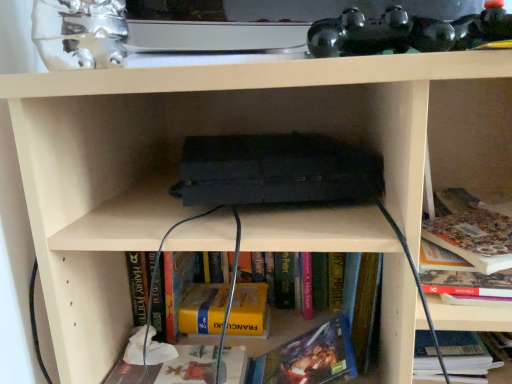
You are a GUI agent. You are given a task and a screenshot of the screen. Output one action in this format:
    pyautogui.click(x=<x>, y=<y>)
    Task: Click on the hardcover book at lower right, which is counted as the fourth book, starting from the left
    This screenshot has width=512, height=384.
    Given the screenshot: What is the action you would take?
    pyautogui.click(x=472, y=232)

The image size is (512, 384). What do you see at coordinates (203, 309) in the screenshot?
I see `yellow matte book at center, which is the 2th book in left-to-right order` at bounding box center [203, 309].

Find the location of `matte paper book at lower center, which ranks as the first book in left-to-right order`. matte paper book at lower center, which ranks as the first book in left-to-right order is located at coordinates (187, 366).

The width and height of the screenshot is (512, 384). I want to click on hardcover book at lower right, which is counted as the first book, starting from the right, so (472, 232).

Is hardcover book at lower right, which is counted as the fourth book, starting from the left, in contact with hardcover book at lower center, the 3th book positioned from the left?

There is a gap between hardcover book at lower right, which is counted as the fourth book, starting from the left, and hardcover book at lower center, the 3th book positioned from the left.

From a real-world perspective, between hardcover book at lower right, which is counted as the fourth book, starting from the left, and hardcover book at lower center, the 3th book positioned from the left, who is vertically lower?

From a 3D spatial view, hardcover book at lower center, the 3th book positioned from the left, is below.

Which of these two, hardcover book at lower right, which is counted as the fourth book, starting from the left, or hardcover book at lower center, the 3th book positioned from the left, is smaller?

With smaller size is hardcover book at lower center, the 3th book positioned from the left.

Does point (504, 263) lie in front of point (310, 336)?

Yes, point (504, 263) is in front of point (310, 336).

Which of these two, hardcover book at lower right, which is counted as the first book, starting from the right, or yellow matte book at center, which is the 2th book in left-to-right order, stands taller?

Standing taller between the two is hardcover book at lower right, which is counted as the first book, starting from the right.

From the picture: How many degrees apart are the facing directions of hardcover book at lower right, which is counted as the first book, starting from the right, and yellow matte book at center, the third book when ordered from right to left?

0.835 degrees separate the facing orientations of hardcover book at lower right, which is counted as the first book, starting from the right, and yellow matte book at center, the third book when ordered from right to left.

Is point (493, 228) closer to camera compared to point (236, 317)?

That is True.

From the image's perspective, between hardcover book at lower right, which is counted as the fourth book, starting from the left, and yellow matte book at center, which is the 2th book in left-to-right order, who is located below?

yellow matte book at center, which is the 2th book in left-to-right order.

Which book is the 3rd one when counting from the left side of the hardcover book at lower right, which is counted as the first book, starting from the right? Please provide its 2D coordinates.

[(187, 366)]

Is hardcover book at lower right, which is counted as the first book, starting from the right, surrounding matte paper book at lower center, which ranks as the first book in left-to-right order?

Actually, matte paper book at lower center, which ranks as the first book in left-to-right order, is outside hardcover book at lower right, which is counted as the first book, starting from the right.

Which object is positioned more to the left, hardcover book at lower right, which is counted as the fourth book, starting from the left, or matte paper book at lower center, which is counted as the 4th book, starting from the right?

From the viewer's perspective, matte paper book at lower center, which is counted as the 4th book, starting from the right, appears more on the left side.

Is hardcover book at lower right, which is counted as the fourth book, starting from the left, far away from matte paper book at lower center, which ranks as the first book in left-to-right order?

They are positioned close to each other.

Is matte paper book at lower center, which is counted as the 4th book, starting from the right, bigger than yellow matte book at center, which is the 2th book in left-to-right order?

Correct, matte paper book at lower center, which is counted as the 4th book, starting from the right, is larger in size than yellow matte book at center, which is the 2th book in left-to-right order.

Measure the distance from matte paper book at lower center, which ranks as the first book in left-to-right order, to yellow matte book at center, which is the 2th book in left-to-right order.

The distance of matte paper book at lower center, which ranks as the first book in left-to-right order, from yellow matte book at center, which is the 2th book in left-to-right order, is 3.97 inches.

In terms of height, does matte paper book at lower center, which is counted as the 4th book, starting from the right, look taller or shorter compared to yellow matte book at center, the third book when ordered from right to left?

Clearly, matte paper book at lower center, which is counted as the 4th book, starting from the right, is shorter compared to yellow matte book at center, the third book when ordered from right to left.

Does matte paper book at lower center, which is counted as the 4th book, starting from the right, come behind yellow matte book at center, the third book when ordered from right to left?

No.

Is matte paper book at lower center, which ranks as the first book in left-to-right order, to the left or to the right of hardcover book at lower right, which is counted as the fourth book, starting from the left, in the image?

Based on their positions, matte paper book at lower center, which ranks as the first book in left-to-right order, is located to the left of hardcover book at lower right, which is counted as the fourth book, starting from the left.

This screenshot has width=512, height=384. There is a hardcover book at lower right, which is counted as the first book, starting from the right. Identify the location of the 3rd book below it (from the image's perspective). (187, 366).

Consider the image. Does matte paper book at lower center, which ranks as the first book in left-to-right order, have a greater height compared to hardcover book at lower right, which is counted as the fourth book, starting from the left?

In fact, matte paper book at lower center, which ranks as the first book in left-to-right order, may be shorter than hardcover book at lower right, which is counted as the fourth book, starting from the left.

Considering the sizes of objects matte paper book at lower center, which is counted as the 4th book, starting from the right, and hardcover book at lower right, which is counted as the fourth book, starting from the left, in the image provided, who is bigger, matte paper book at lower center, which is counted as the 4th book, starting from the right, or hardcover book at lower right, which is counted as the fourth book, starting from the left,?

Bigger between the two is hardcover book at lower right, which is counted as the fourth book, starting from the left.

Is matte paper book at lower center, which is counted as the 4th book, starting from the right, positioned beyond the bounds of hardcover book at lower center, the 3th book positioned from the left?

Yes.

Which object is positioned more to the left, matte paper book at lower center, which ranks as the first book in left-to-right order, or hardcover book at lower center, the 3th book positioned from the left?

matte paper book at lower center, which ranks as the first book in left-to-right order, is more to the left.

From a real-world perspective, relative to hardcover book at lower center, the 3th book positioned from the left, is matte paper book at lower center, which ranks as the first book in left-to-right order, vertically above or below?

In terms of real-world spatial position, matte paper book at lower center, which ranks as the first book in left-to-right order, is below hardcover book at lower center, the 3th book positioned from the left.

Is point (219, 314) closer or farther from the camera than point (248, 376)?

Point (219, 314) is farther from the camera than point (248, 376).

Based on the photo, do you think yellow matte book at center, the third book when ordered from right to left, is within hardcover book at lower center, positioned as the 2th book in right-to-left order, or outside of it?

yellow matte book at center, the third book when ordered from right to left, is not inside hardcover book at lower center, positioned as the 2th book in right-to-left order, it's outside.

Who is taller, yellow matte book at center, the third book when ordered from right to left, or hardcover book at lower center, the 3th book positioned from the left?

hardcover book at lower center, the 3th book positioned from the left, is taller.

From the image's perspective, which book is the 2nd one below the hardcover book at lower right, which is counted as the fourth book, starting from the left? Please provide its 2D coordinates.

[(308, 357)]

Find the location of `book that appears above the yellow matte book at center, which is the 2th book in left-to-right order (from the image's perspective)`. book that appears above the yellow matte book at center, which is the 2th book in left-to-right order (from the image's perspective) is located at coordinates (472, 232).

Which object lies further to the anchor point yellow matte book at center, which is the 2th book in left-to-right order, hardcover book at lower center, positioned as the 2th book in right-to-left order, or hardcover book at lower right, which is counted as the fourth book, starting from the left?

hardcover book at lower right, which is counted as the fourth book, starting from the left.

From the picture: Which object lies nearer to the anchor point hardcover book at lower right, which is counted as the fourth book, starting from the left, matte paper book at lower center, which is counted as the 4th book, starting from the right, or yellow matte book at center, which is the 2th book in left-to-right order?

yellow matte book at center, which is the 2th book in left-to-right order, is closer to hardcover book at lower right, which is counted as the fourth book, starting from the left.

Considering their positions, is matte paper book at lower center, which is counted as the 4th book, starting from the right, positioned closer to hardcover book at lower right, which is counted as the first book, starting from the right, than hardcover book at lower center, positioned as the 2th book in right-to-left order?

hardcover book at lower center, positioned as the 2th book in right-to-left order, is closer to hardcover book at lower right, which is counted as the first book, starting from the right.

When comparing their distances from matte paper book at lower center, which ranks as the first book in left-to-right order, does yellow matte book at center, which is the 2th book in left-to-right order, or hardcover book at lower center, the 3th book positioned from the left, seem closer?

yellow matte book at center, which is the 2th book in left-to-right order, is positioned closer to the anchor matte paper book at lower center, which ranks as the first book in left-to-right order.

When comparing their distances from yellow matte book at center, the third book when ordered from right to left, does hardcover book at lower right, which is counted as the fourth book, starting from the left, or hardcover book at lower center, the 3th book positioned from the left, seem closer?

hardcover book at lower center, the 3th book positioned from the left.

Which object lies nearer to the anchor point matte paper book at lower center, which is counted as the 4th book, starting from the right, hardcover book at lower center, positioned as the 2th book in right-to-left order, or hardcover book at lower right, which is counted as the fourth book, starting from the left?

The object closer to matte paper book at lower center, which is counted as the 4th book, starting from the right, is hardcover book at lower center, positioned as the 2th book in right-to-left order.

Based on their spatial positions, is matte paper book at lower center, which ranks as the first book in left-to-right order, or hardcover book at lower right, which is counted as the first book, starting from the right, further from yellow matte book at center, which is the 2th book in left-to-right order?

Based on the image, hardcover book at lower right, which is counted as the first book, starting from the right, appears to be further to yellow matte book at center, which is the 2th book in left-to-right order.

Considering their positions, is hardcover book at lower right, which is counted as the first book, starting from the right, positioned closer to matte paper book at lower center, which is counted as the 4th book, starting from the right, than yellow matte book at center, which is the 2th book in left-to-right order?

yellow matte book at center, which is the 2th book in left-to-right order, lies closer to matte paper book at lower center, which is counted as the 4th book, starting from the right, than the other object.

I want to click on book situated between yellow matte book at center, the third book when ordered from right to left, and hardcover book at lower right, which is counted as the first book, starting from the right, from left to right, so click(308, 357).

This screenshot has height=384, width=512. I want to click on book located between hardcover book at lower center, positioned as the 2th book in right-to-left order, and yellow matte book at center, the third book when ordered from right to left, in the depth direction, so click(x=187, y=366).